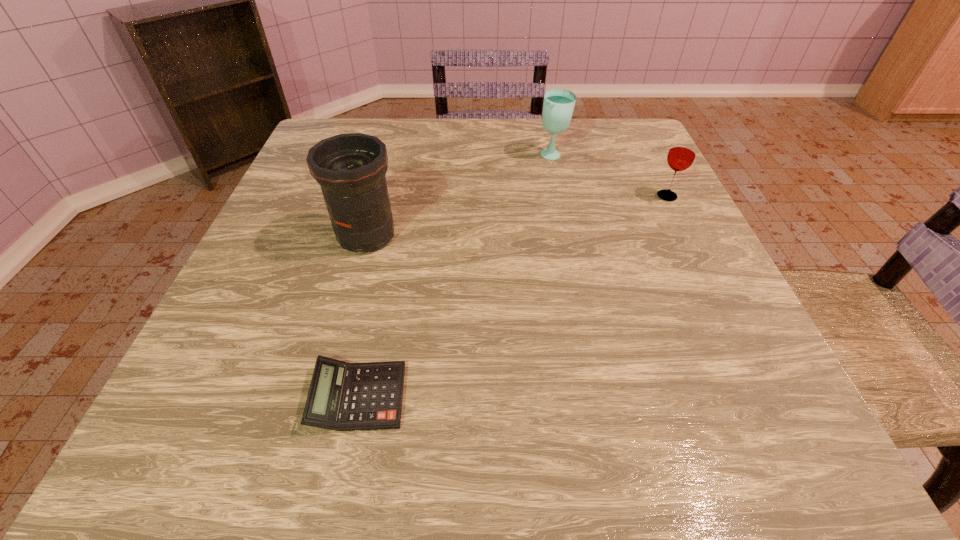
Where is `the second nearest object`? Image resolution: width=960 pixels, height=540 pixels. the second nearest object is located at coordinates (350, 168).

The width and height of the screenshot is (960, 540). In order to click on telephoto lens in this screenshot , I will do `click(350, 168)`.

The image size is (960, 540). In order to click on the farthest object in this screenshot , I will do `click(558, 106)`.

Identify the location of the left glass. (558, 106).

Where is `the second farthest object`? The width and height of the screenshot is (960, 540). the second farthest object is located at coordinates (682, 153).

Find the location of `the rightmost object`. the rightmost object is located at coordinates coord(682,153).

At what (x,y) coordinates should I click in order to perform the action: click on the nearest object. Please return your answer as a coordinate pair (x, y). This screenshot has height=540, width=960. Looking at the image, I should click on (342, 396).

Find the location of a particular element. Image resolution: width=960 pixels, height=540 pixels. the shortest object is located at coordinates pos(342,396).

Locate an element on the screen. The height and width of the screenshot is (540, 960). vacant space located on the right of the tallest object is located at coordinates (600, 236).

Where is `vacant space located on the right of the second object from right to left`? vacant space located on the right of the second object from right to left is located at coordinates coord(660,156).